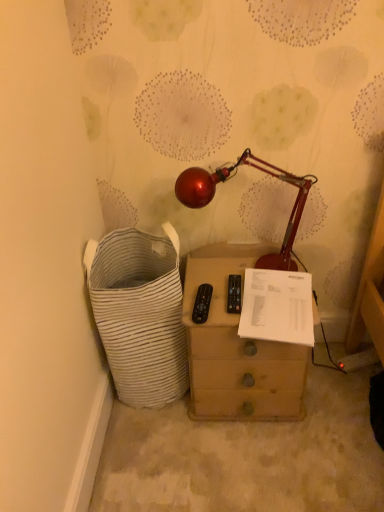
Identify the location of free space above white paper at center (from a real-world perspective). The height and width of the screenshot is (512, 384). (277, 287).